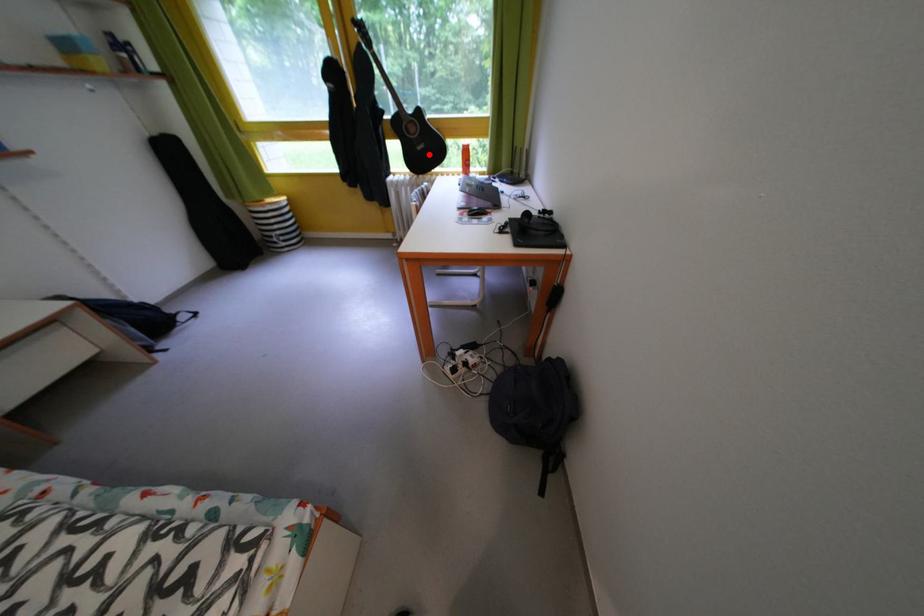
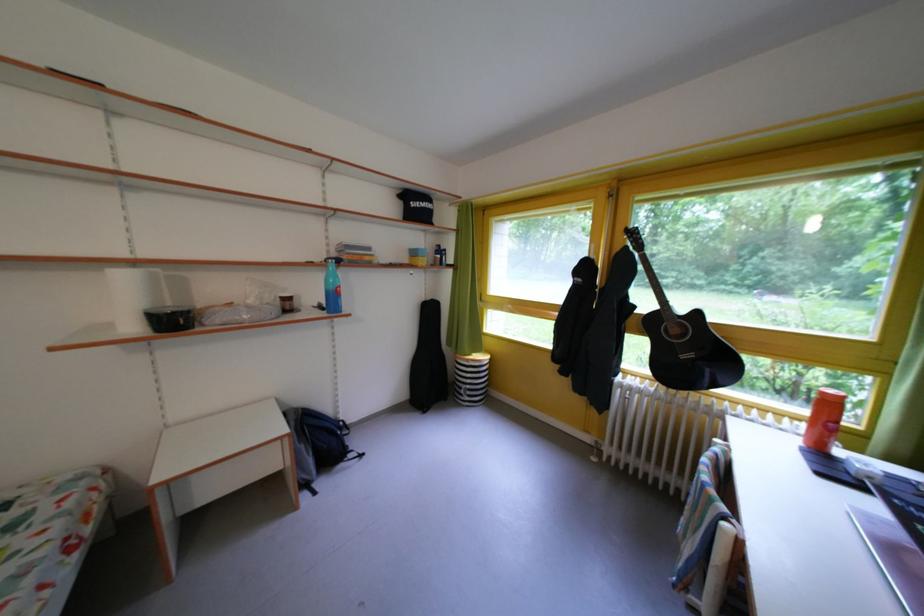
In the second image, find the point that corresponds to the highlighted location in the first image.

(693, 362)